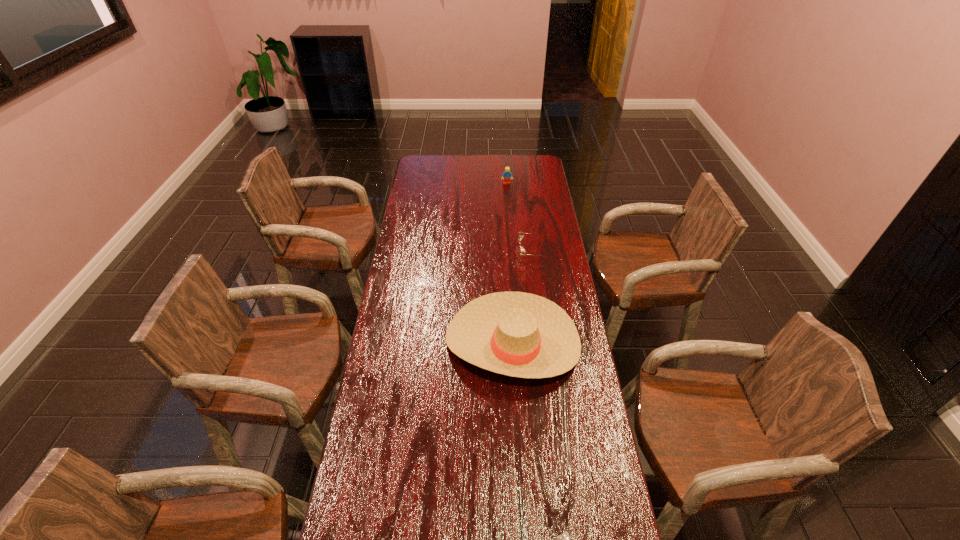
You are a GUI agent. You are given a task and a screenshot of the screen. Output one action in this format:
    pyautogui.click(x=<x>, y=<y>)
    Task: Click on the object that is the third closest to the sunhat
    The height and width of the screenshot is (540, 960).
    Given the screenshot: What is the action you would take?
    pyautogui.click(x=507, y=174)

Find the location of a particular element. the second closest object to the second tallest object is located at coordinates (518, 334).